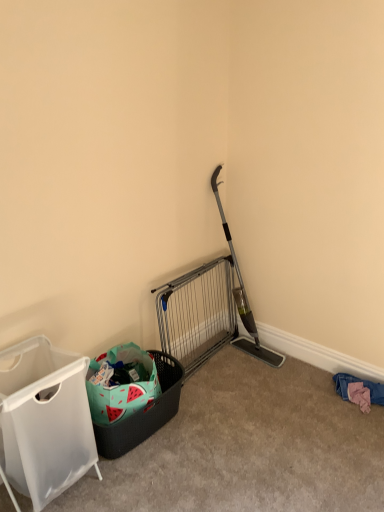
Question: Is watermelon-patterned plastic basket at lower left surrounding silver metallic gate at center?

Choices:
 (A) no
 (B) yes

Answer: (A)

Question: Does watermelon-patterned plastic basket at lower left have a smaller size compared to silver metallic gate at center?

Choices:
 (A) yes
 (B) no

Answer: (A)

Question: From the image's perspective, is watermelon-patterned plastic basket at lower left on top of silver metallic gate at center?

Choices:
 (A) no
 (B) yes

Answer: (A)

Question: Is watermelon-patterned plastic basket at lower left touching silver metallic gate at center?

Choices:
 (A) yes
 (B) no

Answer: (B)

Question: Does watermelon-patterned plastic basket at lower left have a lesser height compared to silver metallic gate at center?

Choices:
 (A) yes
 (B) no

Answer: (A)

Question: From the image's perspective, is pink fabric at lower right positioned above or below white fabric laundry basket at left?

Choices:
 (A) below
 (B) above

Answer: (A)

Question: Is pink fabric at lower right wider or thinner than white fabric laundry basket at left?

Choices:
 (A) thin
 (B) wide

Answer: (A)

Question: Is pink fabric at lower right inside the boundaries of white fabric laundry basket at left, or outside?

Choices:
 (A) outside
 (B) inside

Answer: (A)

Question: Is pink fabric at lower right taller or shorter than white fabric laundry basket at left?

Choices:
 (A) tall
 (B) short

Answer: (B)

Question: From the image's perspective, is white fabric laundry basket at left above or below watermelon-patterned plastic basket at lower left?

Choices:
 (A) above
 (B) below

Answer: (A)

Question: From a real-world perspective, relative to watermelon-patterned plastic basket at lower left, is white fabric laundry basket at left vertically above or below?

Choices:
 (A) above
 (B) below

Answer: (A)

Question: Considering the positions of white fabric laundry basket at left and watermelon-patterned plastic basket at lower left in the image, is white fabric laundry basket at left bigger or smaller than watermelon-patterned plastic basket at lower left?

Choices:
 (A) small
 (B) big

Answer: (B)

Question: Is white fabric laundry basket at left taller or shorter than watermelon-patterned plastic basket at lower left?

Choices:
 (A) tall
 (B) short

Answer: (A)

Question: Considering the positions of point (210, 317) and point (97, 451), is point (210, 317) closer or farther from the camera than point (97, 451)?

Choices:
 (A) farther
 (B) closer

Answer: (A)

Question: Considering their positions, is silver metallic gate at center located in front of or behind watermelon-patterned plastic basket at lower left?

Choices:
 (A) front
 (B) behind

Answer: (B)